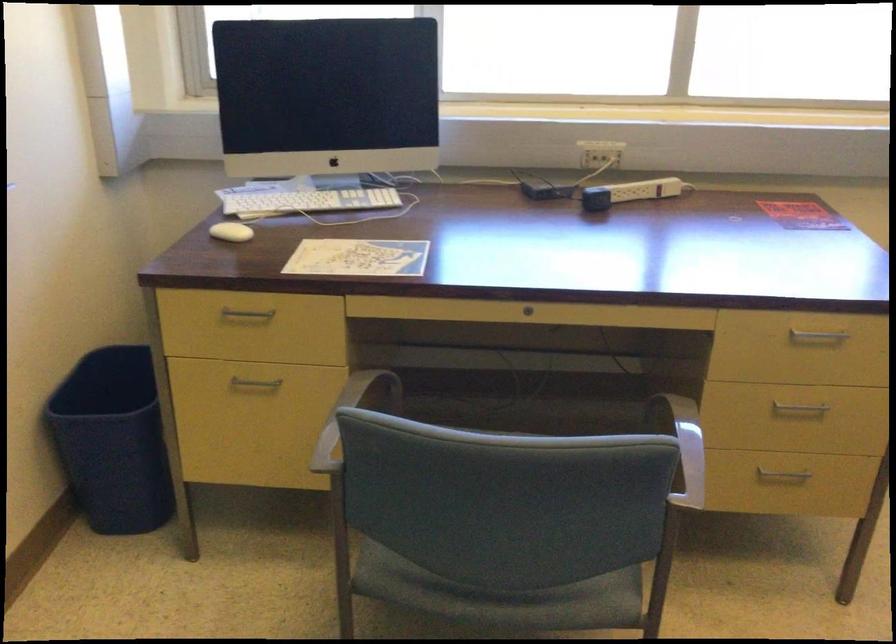
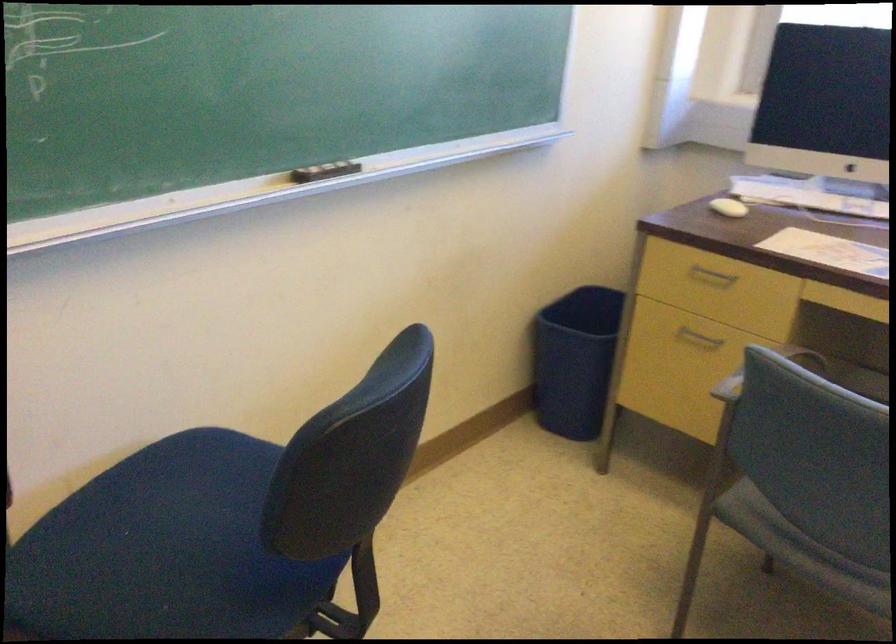
Find the pixel in the second image that matches [364,436] in the first image.

(764, 371)